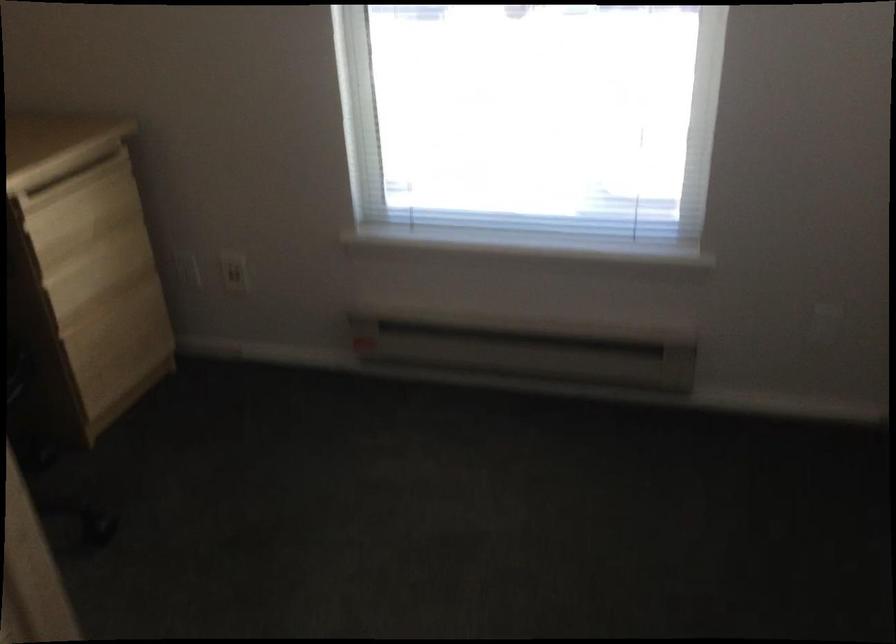
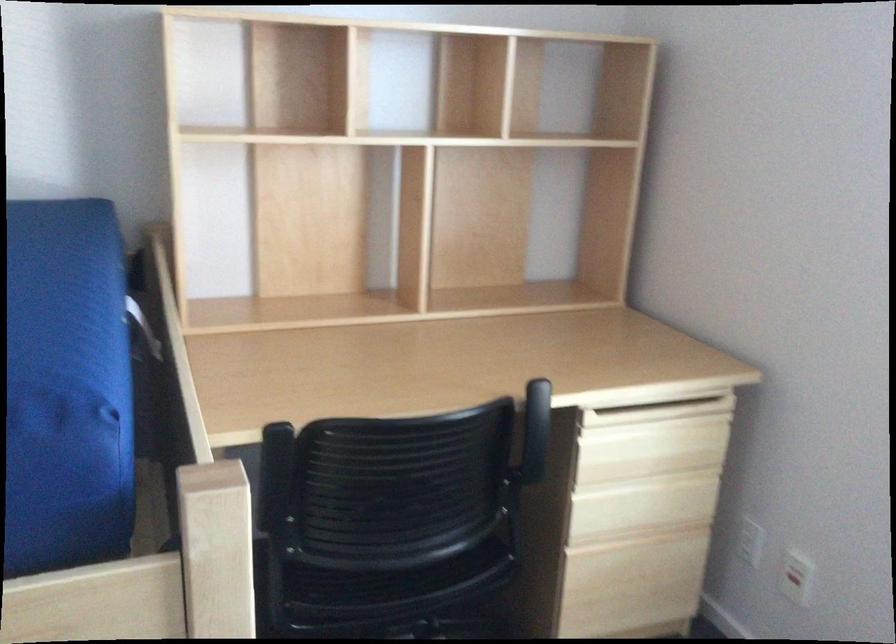
The point at (188, 266) is marked in the first image. Where is the corresponding point in the second image?

(750, 541)